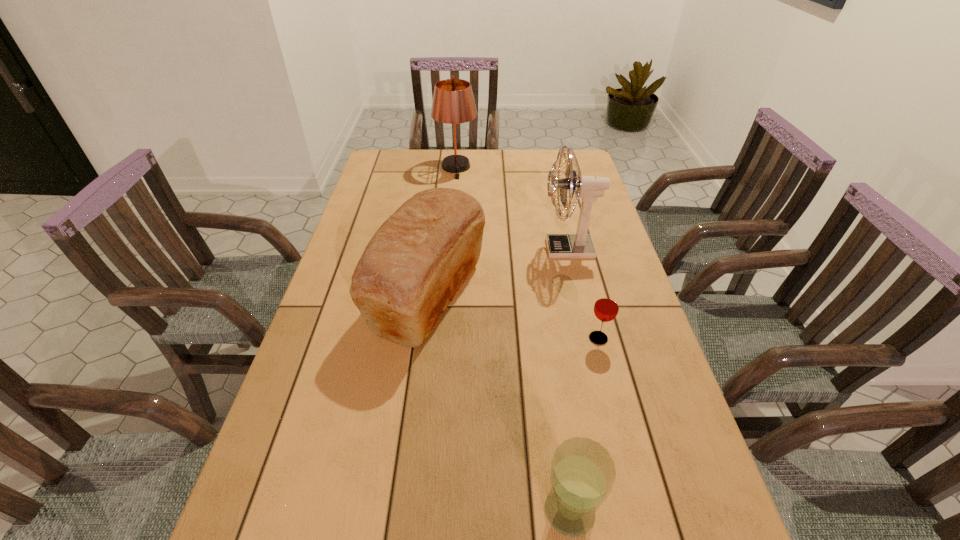
At what (x,y) coordinates should I click in order to perform the action: click on the farthest object. Please return your answer as a coordinate pair (x, y). Looking at the image, I should click on (453, 102).

Where is `fan`? This screenshot has width=960, height=540. fan is located at coordinates (580, 245).

Locate an element on the screen. The width and height of the screenshot is (960, 540). bread is located at coordinates [x=415, y=263].

Locate an element on the screen. The width and height of the screenshot is (960, 540). the shortest object is located at coordinates (606, 307).

The width and height of the screenshot is (960, 540). What are the coordinates of `the shorter glass` in the screenshot? It's located at (606, 307).

Where is `vacant space located on the front-facing side of the lampshade`? Image resolution: width=960 pixels, height=540 pixels. vacant space located on the front-facing side of the lampshade is located at coordinates (454, 195).

Find the location of a particular element. free space located 0.370m on the front-facing side of the fan is located at coordinates (420, 249).

I want to click on free space located on the front-facing side of the fan, so click(x=522, y=249).

The image size is (960, 540). What are the coordinates of `free location located on the front-facing side of the fan` in the screenshot? It's located at (473, 249).

Identify the location of vacant area situated on the right of the bread. (592, 295).